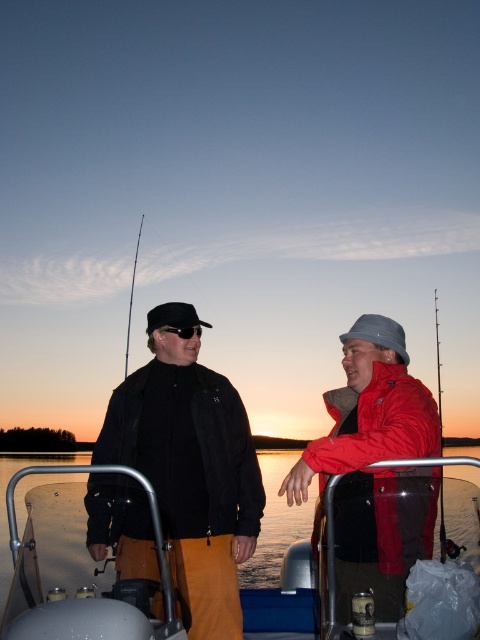
You are a photographer trying to capture a closeup shot of the black matte jacket at center and the black matte goggles at center. Since you want both items to be in focus, you need to know their relative sizes. Which object is larger?

The black matte jacket at center is taller than black matte goggles at center, so the black matte jacket at center is larger.

You are a delivery drone that needs to fly between the red matte jacket at right and the metallic fishing pole at right. The drone has a wingspan of 1 meter. Can it safely pass through the space between them without touching either object?

The distance between the red matte jacket at right and the metallic fishing pole at right is 1.11 meters. Since the drone has a wingspan of 1 meter, it can safely pass through the space between them without touching either object.

You are standing on the boat and want to hand the red matte jacket at right to someone. Where should you look to find it?

The red matte jacket at right is located at point [376,468], so you should look there to find it.